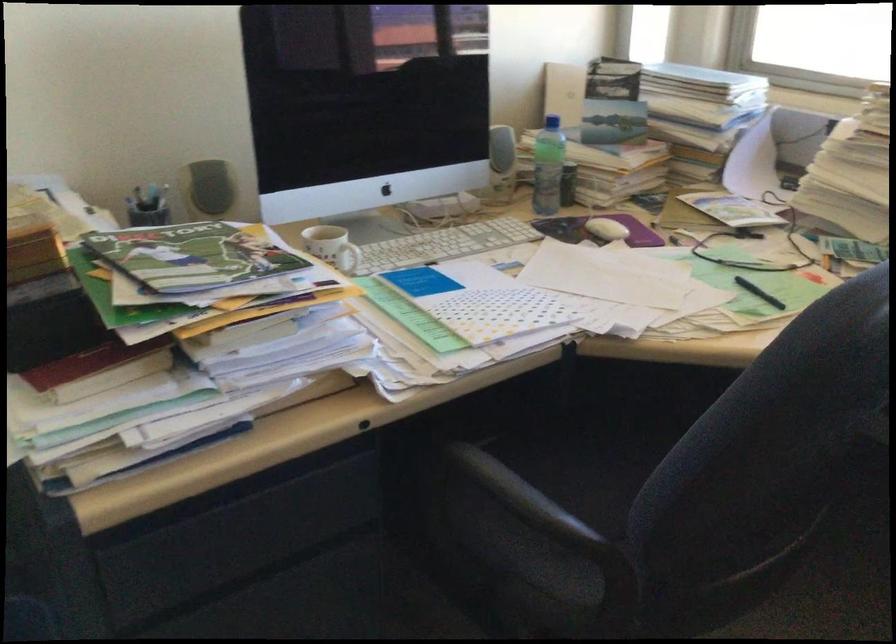
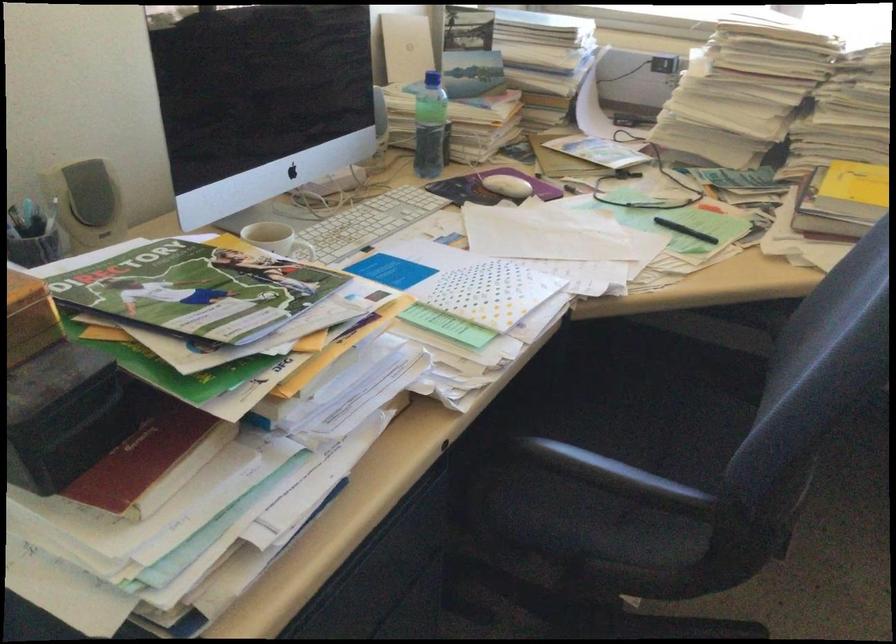
The point at [497,488] is marked in the first image. Where is the corresponding point in the second image?

(614, 474)